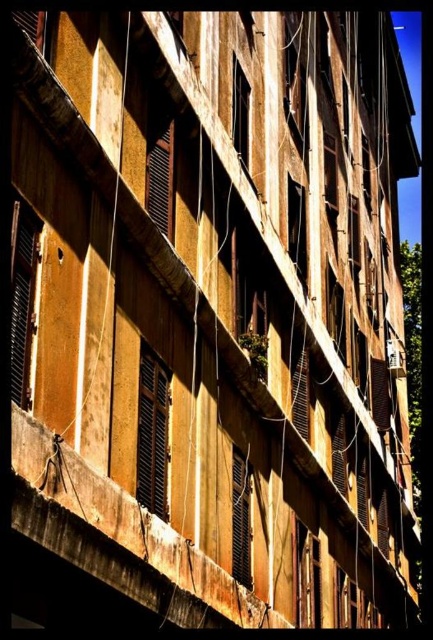
Question: Which object is positioned farthest from the matte wooden window at center?

Choices:
 (A) matte brown wooden window at upper center
 (B) matte black window at center
 (C) matte brown window at center

Answer: (A)

Question: From the image, what is the correct spatial relationship of wooden window frame at center in relation to matte black window at center?

Choices:
 (A) above
 (B) below

Answer: (B)

Question: Which is farther from the wooden shutters at center?

Choices:
 (A) matte brown wooden window at upper center
 (B) matte brown window at center
 (C) matte black window at center
 (D) matte black shutters at center

Answer: (A)

Question: Among these points, which one is nearest to the camera?

Choices:
 (A) (x=164, y=429)
 (B) (x=293, y=76)
 (C) (x=171, y=198)
 (D) (x=300, y=548)

Answer: (A)

Question: Is wooden shutters at center positioned at the back of black matte shutters at left?

Choices:
 (A) no
 (B) yes

Answer: (B)

Question: Can you confirm if black matte shutters at left is positioned to the right of brown wooden window at center?

Choices:
 (A) no
 (B) yes

Answer: (A)